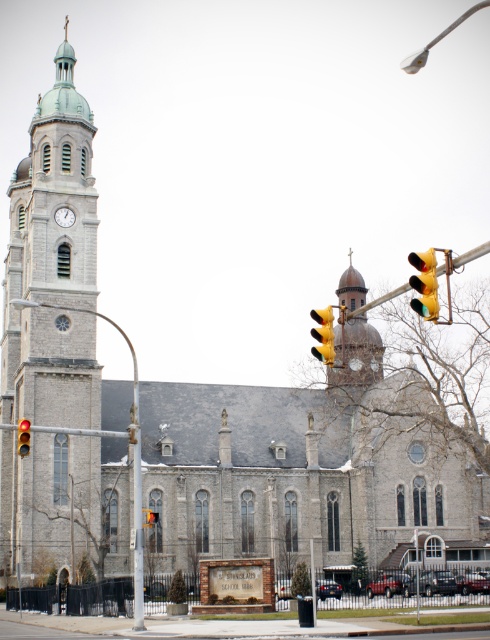
You are a pedestrian standing at the crosswalk looking towards the brown stone clock tower at center and the yellow plastic traffic light at upper center. Which object is positioned to the right side from your perspective?

The brown stone clock tower at center is positioned to the right of the yellow plastic traffic light at upper center, so from your perspective, the brown stone clock tower at center is on the right side.

You are a city planner assessing the visibility of traffic lights and clock faces for pedestrians. Given the image, which object between the yellow matte traffic light at center and the white clock face at upper left has a greater width?

The yellow matte traffic light at center has a greater width than the white clock face at upper left according to the description.